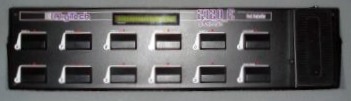
What are the coordinates of `receiver` in the screenshot? It's located at (52, 21).